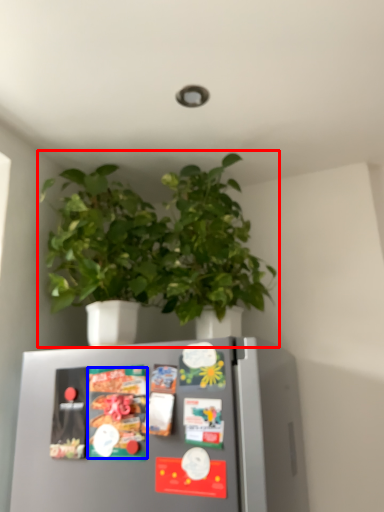
Question: Which object is closer to the camera taking this photo, houseplant (highlighted by a red box) or food (highlighted by a blue box)?

Choices:
 (A) houseplant
 (B) food

Answer: (B)